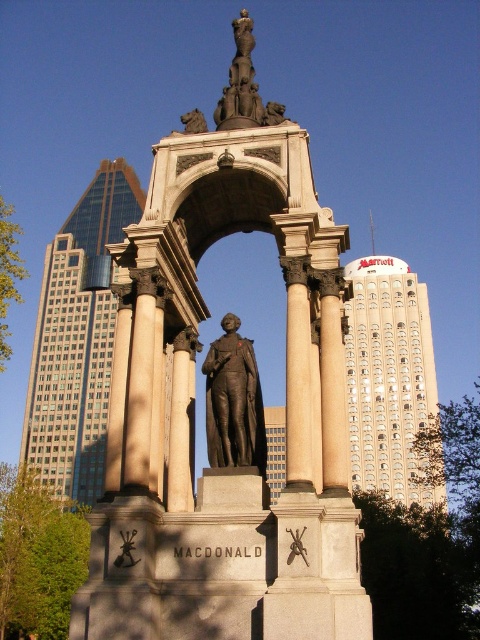
You are an art student analyzing the composition of the monument. You observe the bronze statue at center. Based on its coordinates, where exactly is the bronze statue located within the monument?

The bronze statue at center is positioned at coordinates point [228,417] within the monument.